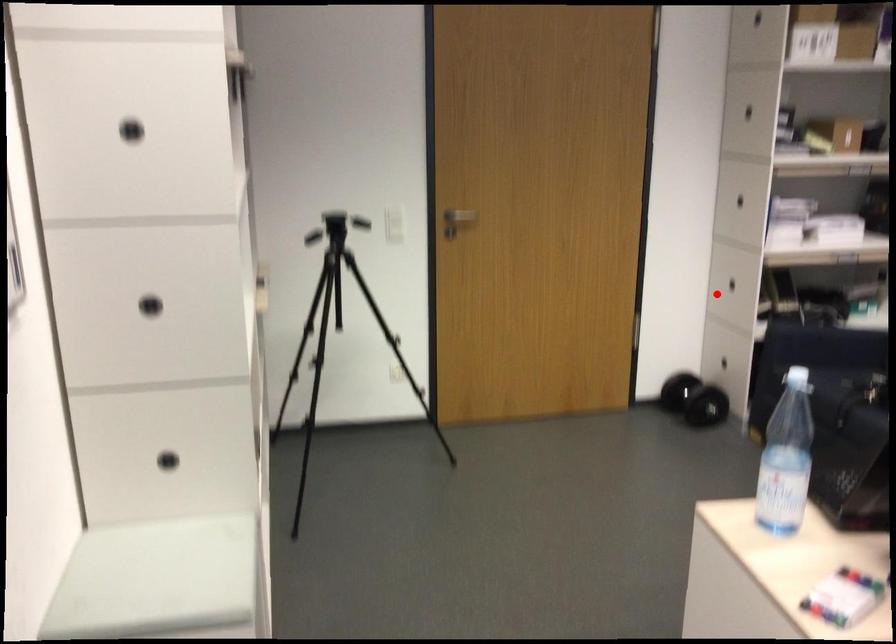
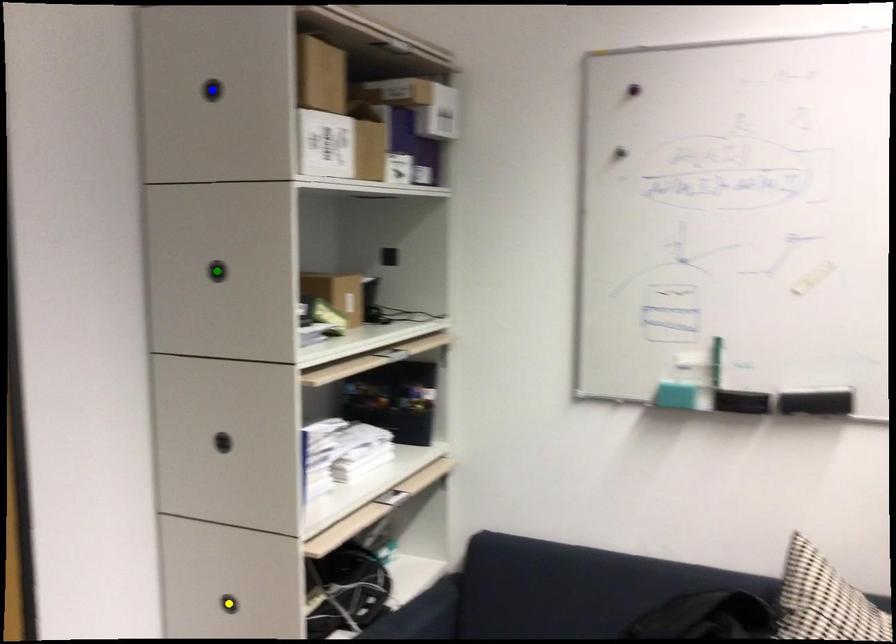
Question: I am providing you with two images of the same scene from different viewpoints. A red point is marked on the first image. You are given multiple points on the second image. In image 2, which mark is for the same physical point as the one in image 1?

Choices:
 (A) blue point
 (B) green point
 (C) yellow point

Answer: (C)